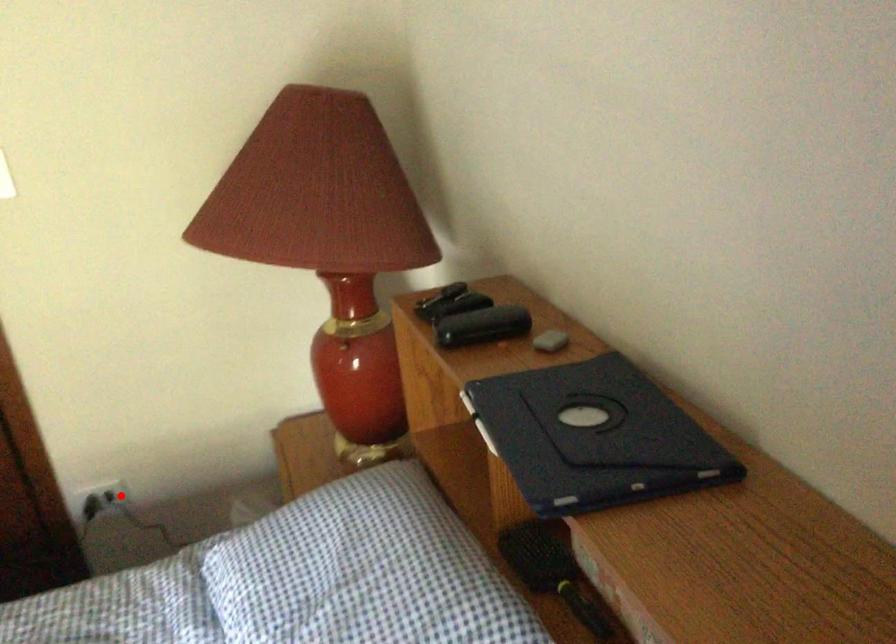
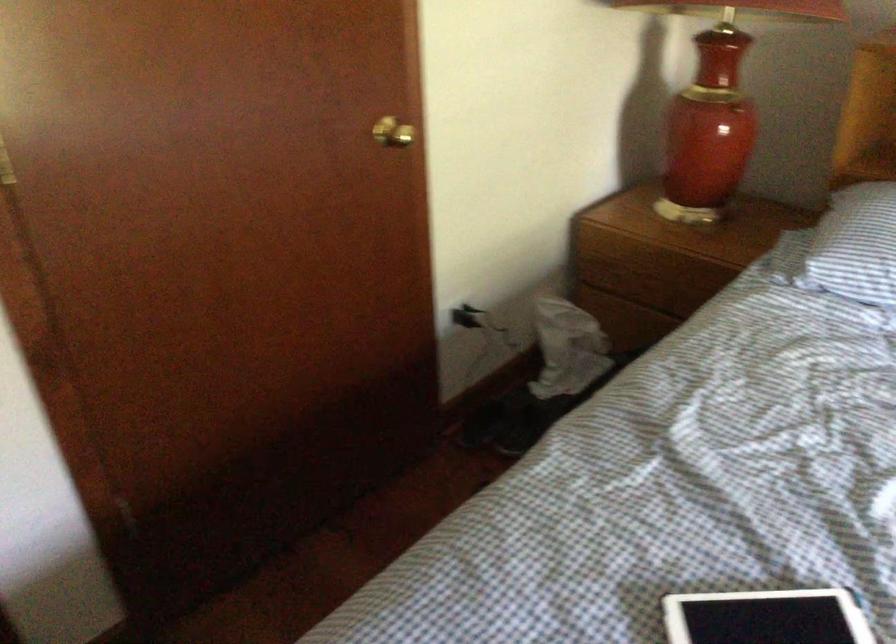
The point at the highlighted location is marked in the first image. Where is the corresponding point in the second image?

(470, 317)